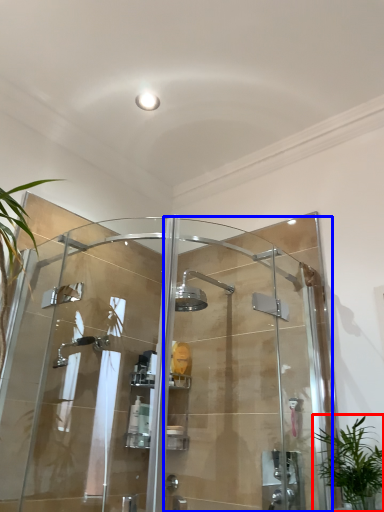
Question: Which of the following is the farthest to the observer, houseplant (highlighted by a red box) or screen door (highlighted by a blue box)?

Choices:
 (A) houseplant
 (B) screen door

Answer: (A)